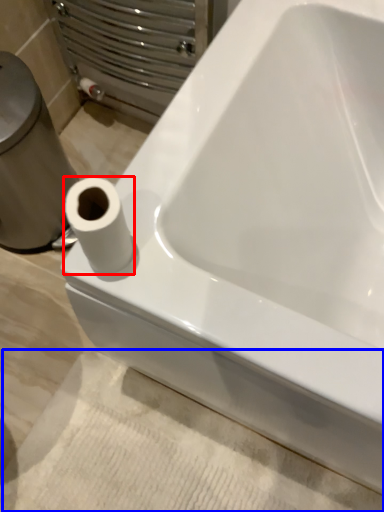
Question: Which point is further to the camera, toilet paper (highlighted by a red box) or bath mat (highlighted by a blue box)?

Choices:
 (A) toilet paper
 (B) bath mat

Answer: (B)